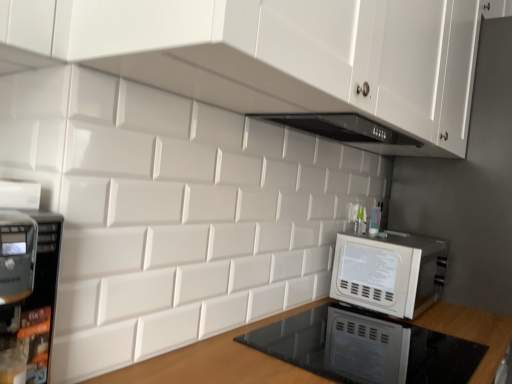
Question: Considering the relative sizes of white glossy microwave at right and wooden at lower center in the image provided, is white glossy microwave at right taller than wooden at lower center?

Choices:
 (A) yes
 (B) no

Answer: (B)

Question: Could you tell me if white glossy microwave at right is facing wooden at lower center?

Choices:
 (A) no
 (B) yes

Answer: (A)

Question: Does white glossy microwave at right have a greater width compared to wooden at lower center?

Choices:
 (A) yes
 (B) no

Answer: (B)

Question: From the image's perspective, is white glossy microwave at right on top of wooden at lower center?

Choices:
 (A) no
 (B) yes

Answer: (B)

Question: Considering the relative positions of white glossy microwave at right and wooden at lower center in the image provided, is white glossy microwave at right to the right of wooden at lower center from the viewer's perspective?

Choices:
 (A) yes
 (B) no

Answer: (A)

Question: From a real-world perspective, relative to white glossy cabinet at upper center, is wooden at lower center vertically above or below?

Choices:
 (A) above
 (B) below

Answer: (B)

Question: Is wooden at lower center wider or thinner than white glossy cabinet at upper center?

Choices:
 (A) wide
 (B) thin

Answer: (A)

Question: In the image, is wooden at lower center on the left side or the right side of white glossy cabinet at upper center?

Choices:
 (A) right
 (B) left

Answer: (B)

Question: Relative to white glossy cabinet at upper center, is wooden at lower center in front or behind?

Choices:
 (A) behind
 (B) front

Answer: (B)

Question: From the image's perspective, is white glossy cabinet at upper center positioned above or below white glossy microwave at right?

Choices:
 (A) below
 (B) above

Answer: (B)

Question: Considering the positions of point (415, 127) and point (423, 264), is point (415, 127) closer or farther from the camera than point (423, 264)?

Choices:
 (A) farther
 (B) closer

Answer: (B)

Question: From a real-world perspective, is white glossy cabinet at upper center physically located above or below white glossy microwave at right?

Choices:
 (A) below
 (B) above

Answer: (B)

Question: Is white glossy cabinet at upper center spatially inside white glossy microwave at right, or outside of it?

Choices:
 (A) inside
 (B) outside

Answer: (B)

Question: Based on their positions, is white glossy cabinet at upper center located to the left or right of wooden at lower center?

Choices:
 (A) left
 (B) right

Answer: (B)

Question: Considering the positions of white glossy cabinet at upper center and wooden at lower center in the image, is white glossy cabinet at upper center taller or shorter than wooden at lower center?

Choices:
 (A) tall
 (B) short

Answer: (A)